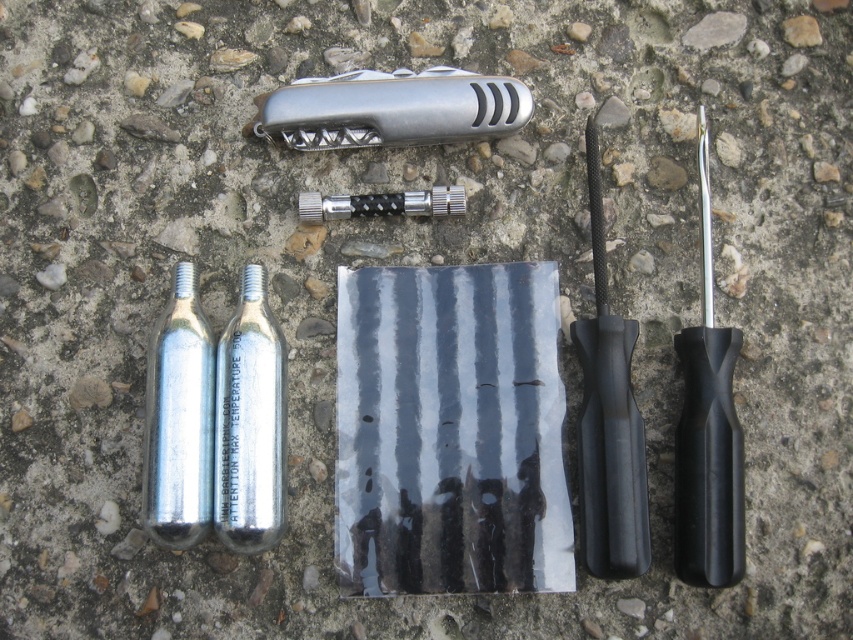
Question: Can you confirm if silver metallic cylinder at center is bigger than black textured razor at center?

Choices:
 (A) no
 (B) yes

Answer: (B)

Question: Which object is closer to the camera taking this photo?

Choices:
 (A) silver metallic cylinder at center
 (B) black textured razor at right
 (C) black plastic razor at right

Answer: (C)

Question: Is black textured razor at right positioned before black plastic razor at right?

Choices:
 (A) yes
 (B) no

Answer: (B)

Question: Which object is positioned closest to the black plastic razor at right?

Choices:
 (A) silver metallic pocketknife at center
 (B) black textured razor at center
 (C) black textured razor at right
 (D) silver metallic cylinder at center

Answer: (C)

Question: Does black textured razor at right have a smaller size compared to silver metallic cylinder at center?

Choices:
 (A) yes
 (B) no

Answer: (B)

Question: Which point is closer to the camera taking this photo?

Choices:
 (A) (166, 493)
 (B) (729, 525)

Answer: (B)